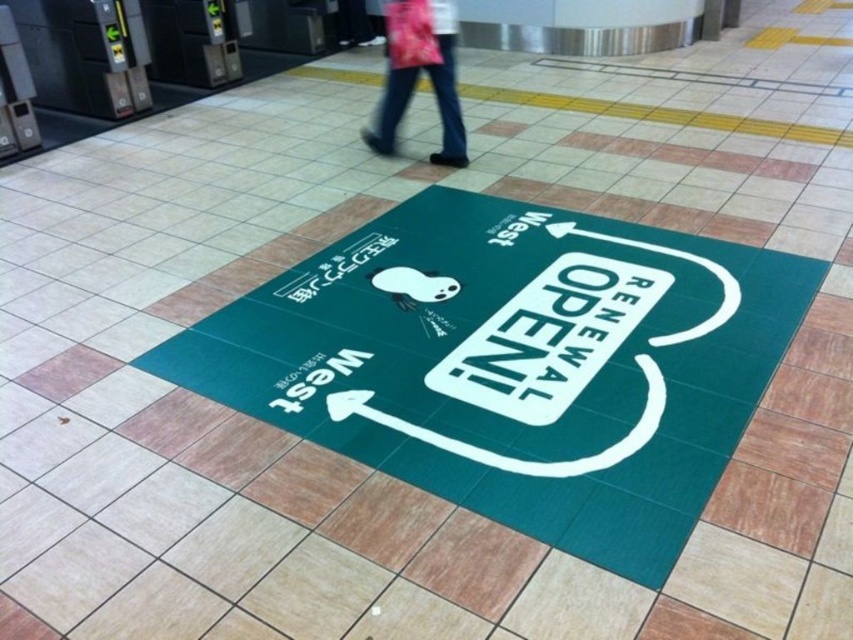
Which of these two, green rubber mat at center or pink fabric pants at upper center, stands taller?

green rubber mat at center

The width and height of the screenshot is (853, 640). Describe the element at coordinates (517, 364) in the screenshot. I see `green rubber mat at center` at that location.

The image size is (853, 640). Describe the element at coordinates (517, 364) in the screenshot. I see `green rubber mat at center` at that location.

Locate an element on the screen. This screenshot has height=640, width=853. green rubber mat at center is located at coordinates (517, 364).